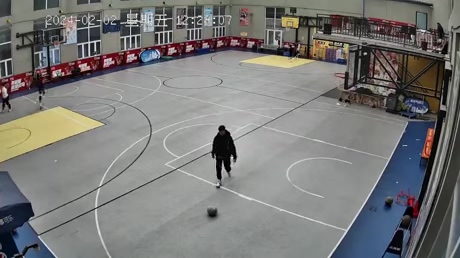
Image resolution: width=460 pixels, height=258 pixels. What are the coordinates of `paint` in the screenshot? It's located at (162, 129).